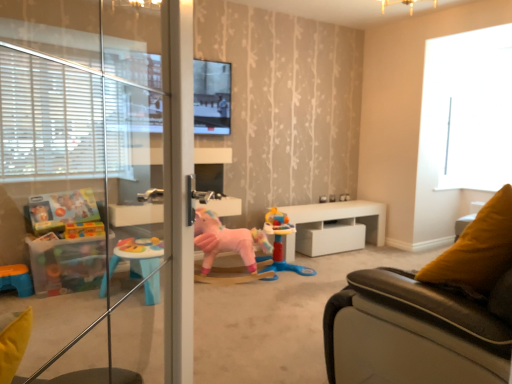
Measure the distance between point (x=205, y=133) and camera.

They are 3.76 meters apart.

Measure the distance between rubberized plastic playset at center, the second toy when ordered from left to right, and camera.

They are 3.28 meters apart.

The image size is (512, 384). Identify the location of transparent glass window at upper right. (468, 110).

This screenshot has width=512, height=384. I want to click on pink plush unicorn at center, placed as the 2th toy when sorted from right to left, so click(x=227, y=246).

Is rubberized plastic playset at center, the first toy in the right-to-left sequence, touching transparent glass screen door at left?

No, rubberized plastic playset at center, the first toy in the right-to-left sequence, is not in contact with transparent glass screen door at left.

Is the depth of rubberized plastic playset at center, the second toy when ordered from left to right, less than that of transparent glass screen door at left?

No, rubberized plastic playset at center, the second toy when ordered from left to right, is behind transparent glass screen door at left.

Consider the image. From a real-world perspective, which is physically below, rubberized plastic playset at center, the first toy in the right-to-left sequence, or transparent glass screen door at left?

In real-world perspective, rubberized plastic playset at center, the first toy in the right-to-left sequence, is lower.

Can we say rubberized plastic playset at center, the first toy in the right-to-left sequence, lies outside transparent glass screen door at left?

Yes, rubberized plastic playset at center, the first toy in the right-to-left sequence, is outside of transparent glass screen door at left.

In the scene shown: Could you tell me if leather couch at right is turned towards rubberized plastic playset at center, the second toy when ordered from left to right?

Yes, leather couch at right is oriented towards rubberized plastic playset at center, the second toy when ordered from left to right.

This screenshot has height=384, width=512. What are the coordinates of `studio couch above the rubberized plastic playset at center, the first toy in the right-to-left sequence (from the image's perspective)` in the screenshot? It's located at (430, 313).

Is leather couch at right taller than rubberized plastic playset at center, the second toy when ordered from left to right?

Indeed, leather couch at right has a greater height compared to rubberized plastic playset at center, the second toy when ordered from left to right.

Considering the points (375, 346) and (284, 260), which point is in front, point (375, 346) or point (284, 260)?

Point (375, 346)

From a real-world perspective, is pink plush unicorn at center, acting as the 1th toy starting from the left, positioned under transparent glass screen door at left based on gravity?

Yes, from a real-world perspective, pink plush unicorn at center, acting as the 1th toy starting from the left, is under transparent glass screen door at left.

Is pink plush unicorn at center, acting as the 1th toy starting from the left, aimed at transparent glass screen door at left?

Yes, pink plush unicorn at center, acting as the 1th toy starting from the left, is turned towards transparent glass screen door at left.

Does point (253, 277) appear closer or farther from the camera than point (153, 338)?

Point (253, 277) appears to be farther away from the viewer than point (153, 338).

From a real-world perspective, is leather couch at right physically located above or below white glossy table at center?

From a real-world perspective, leather couch at right is physically above white glossy table at center.

Which object is closer to the camera, leather couch at right or white glossy table at center?

Positioned in front is leather couch at right.

Is white glossy table at center completely or partially inside leather couch at right?

That's incorrect, white glossy table at center is not inside leather couch at right.

Is leather couch at right directly adjacent to white glossy table at center?

They are not placed beside each other.

Can you tell me how much transparent glass screen door at left and white glossy table at center differ in facing direction?

transparent glass screen door at left and white glossy table at center are facing 129 degrees away from each other.

Is transparent glass screen door at left not near white glossy table at center?

transparent glass screen door at left is far away from white glossy table at center.

Is point (155, 50) closer to viewer compared to point (329, 217)?

That is True.

Who is bigger, transparent glass screen door at left or white glossy table at center?

white glossy table at center is bigger.

Does point (254, 263) lie behind point (287, 221)?

That is False.

In the image, is pink plush unicorn at center, placed as the 2th toy when sorted from right to left, positioned in front of or behind rubberized plastic playset at center, the first toy in the right-to-left sequence?

In the image, pink plush unicorn at center, placed as the 2th toy when sorted from right to left, appears in front of rubberized plastic playset at center, the first toy in the right-to-left sequence.

Considering the sizes of objects pink plush unicorn at center, acting as the 1th toy starting from the left, and rubberized plastic playset at center, the second toy when ordered from left to right, in the image provided, who is wider, pink plush unicorn at center, acting as the 1th toy starting from the left, or rubberized plastic playset at center, the second toy when ordered from left to right,?

With larger width is rubberized plastic playset at center, the second toy when ordered from left to right.

Is leather couch at right inside the boundaries of transparent glass screen door at left, or outside?

leather couch at right exists outside the volume of transparent glass screen door at left.

From a real-world perspective, is leather couch at right above or below transparent glass screen door at left?

Clearly, from a real-world perspective, leather couch at right is below transparent glass screen door at left.

Looking at this image, how different are the orientations of leather couch at right and transparent glass screen door at left in degrees?

50.9 degrees.

Is leather couch at right directly adjacent to transparent glass screen door at left?

No, leather couch at right is not next to transparent glass screen door at left.

The height and width of the screenshot is (384, 512). In order to click on screen door in front of the rubberized plastic playset at center, the first toy in the right-to-left sequence in this screenshot , I will do `click(73, 126)`.

Image resolution: width=512 pixels, height=384 pixels. There is a leather couch at right. Find the location of `the 1st toy below it (from the image's perspective)`. the 1st toy below it (from the image's perspective) is located at coordinates (282, 243).

When comparing their distances from transparent glass window at upper right, does transparent glass screen door at left or white glossy table at center seem further?

The object further to transparent glass window at upper right is transparent glass screen door at left.

From the image, which object appears to be farther from matte black tv at upper center, transparent glass screen door at left or white glossy table at center?

The object further to matte black tv at upper center is white glossy table at center.

When comparing their distances from leather couch at right, does white glossy table at center or transparent glass screen door at left seem further?

white glossy table at center lies further to leather couch at right than the other object.

Considering their positions, is matte black tv at upper center positioned further to transparent glass window at upper right than transparent glass screen door at left?

Among the two, transparent glass screen door at left is located further to transparent glass window at upper right.

Based on their spatial positions, is transparent glass window at upper right or transparent glass screen door at left closer to matte black tv at upper center?

transparent glass screen door at left is positioned closer to the anchor matte black tv at upper center.

Considering their positions, is rubberized plastic playset at center, the first toy in the right-to-left sequence, positioned further to transparent glass window at upper right than matte black tv at upper center?

The object further to transparent glass window at upper right is matte black tv at upper center.

Estimate the real-world distances between objects in this image. Which object is further from rubberized plastic playset at center, the first toy in the right-to-left sequence, matte black tv at upper center or transparent glass window at upper right?

Among the two, transparent glass window at upper right is located further to rubberized plastic playset at center, the first toy in the right-to-left sequence.

Looking at the image, which one is located closer to pink plush unicorn at center, placed as the 2th toy when sorted from right to left, white glossy table at center or matte black tv at upper center?

The object closer to pink plush unicorn at center, placed as the 2th toy when sorted from right to left, is white glossy table at center.

I want to click on studio couch positioned between transparent glass screen door at left and white glossy table at center from near to far, so click(430, 313).

What are the coordinates of `table between matte black tv at upper center and pink plush unicorn at center, placed as the 2th toy when sorted from right to left, from top to bottom` in the screenshot? It's located at (342, 215).

Where is `toy between matte black tv at upper center and pink plush unicorn at center, acting as the 1th toy starting from the left, vertically`? toy between matte black tv at upper center and pink plush unicorn at center, acting as the 1th toy starting from the left, vertically is located at coordinates (282, 243).

Image resolution: width=512 pixels, height=384 pixels. I want to click on window screen between leather couch at right and white glossy table at center in the front-back direction, so click(x=212, y=97).